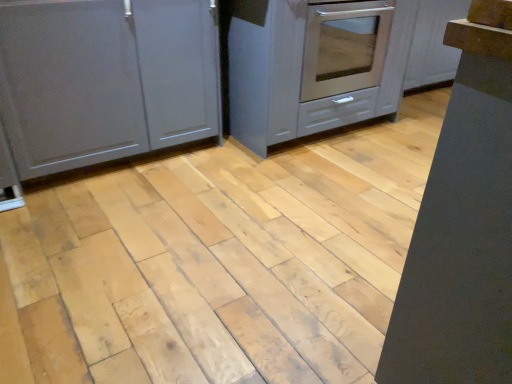
Describe the element at coordinates (314, 65) in the screenshot. This screenshot has height=384, width=512. I see `satin gray cabinet at center, which is the 2th cabinetry from left to right` at that location.

Find the location of a particular element. This screenshot has width=512, height=384. satin gray cabinet at center, the 1th cabinetry in the right-to-left sequence is located at coordinates (314, 65).

In order to face matte gray cabinet at left, which ranks as the 2th cabinetry in right-to-left order, should I rotate leftwards or rightwards?

Rotate your view left by about 19.146°.

The width and height of the screenshot is (512, 384). Describe the element at coordinates (105, 79) in the screenshot. I see `matte gray cabinet at left, which ranks as the 2th cabinetry in right-to-left order` at that location.

Locate an element on the screen. This screenshot has height=384, width=512. matte gray cabinet at left, which ranks as the 2th cabinetry in right-to-left order is located at coordinates (105, 79).

At what (x,y) coordinates should I click in order to perform the action: click on satin gray cabinet at center, the 1th cabinetry in the right-to-left sequence. Please return your answer as a coordinate pair (x, y). The image size is (512, 384). Looking at the image, I should click on (314, 65).

Can you confirm if matte gray cabinet at left, which ranks as the 2th cabinetry in right-to-left order, is positioned to the right of satin gray cabinet at center, which is the 2th cabinetry from left to right?

In fact, matte gray cabinet at left, which ranks as the 2th cabinetry in right-to-left order, is to the left of satin gray cabinet at center, which is the 2th cabinetry from left to right.

Relative to satin gray cabinet at center, which is the 2th cabinetry from left to right, is matte gray cabinet at left, which ranks as the 2th cabinetry in right-to-left order, in front or behind?

Clearly, matte gray cabinet at left, which ranks as the 2th cabinetry in right-to-left order, is in front of satin gray cabinet at center, which is the 2th cabinetry from left to right.

Which is less distant, [41,60] or [265,132]?

Point [41,60].

From the image's perspective, which one is positioned higher, matte gray cabinet at left, which ranks as the 2th cabinetry in right-to-left order, or satin gray cabinet at center, which is the 2th cabinetry from left to right?

satin gray cabinet at center, which is the 2th cabinetry from left to right, is shown above in the image.

From a real-world perspective, does matte gray cabinet at left, the 1th cabinetry in the left-to-right sequence, sit lower than satin gray cabinet at center, the 1th cabinetry in the right-to-left sequence?

Yes, from a real-world perspective, matte gray cabinet at left, the 1th cabinetry in the left-to-right sequence, is under satin gray cabinet at center, the 1th cabinetry in the right-to-left sequence.

Is matte gray cabinet at left, which ranks as the 2th cabinetry in right-to-left order, wider than satin gray cabinet at center, the 1th cabinetry in the right-to-left sequence?

In fact, matte gray cabinet at left, which ranks as the 2th cabinetry in right-to-left order, might be narrower than satin gray cabinet at center, the 1th cabinetry in the right-to-left sequence.

Considering the relative sizes of matte gray cabinet at left, which ranks as the 2th cabinetry in right-to-left order, and satin gray cabinet at center, the 1th cabinetry in the right-to-left sequence, in the image provided, is matte gray cabinet at left, which ranks as the 2th cabinetry in right-to-left order, taller than satin gray cabinet at center, the 1th cabinetry in the right-to-left sequence,?

Indeed, matte gray cabinet at left, which ranks as the 2th cabinetry in right-to-left order, has a greater height compared to satin gray cabinet at center, the 1th cabinetry in the right-to-left sequence.

Is matte gray cabinet at left, the 1th cabinetry in the left-to-right sequence, smaller than satin gray cabinet at center, which is the 2th cabinetry from left to right?

Yes, matte gray cabinet at left, the 1th cabinetry in the left-to-right sequence, is smaller than satin gray cabinet at center, which is the 2th cabinetry from left to right.

Is matte gray cabinet at left, the 1th cabinetry in the left-to-right sequence, completely or partially outside of satin gray cabinet at center, the 1th cabinetry in the right-to-left sequence?

Indeed, matte gray cabinet at left, the 1th cabinetry in the left-to-right sequence, is completely outside satin gray cabinet at center, the 1th cabinetry in the right-to-left sequence.

Could you tell me if matte gray cabinet at left, which ranks as the 2th cabinetry in right-to-left order, is facing satin gray cabinet at center, which is the 2th cabinetry from left to right?

No, matte gray cabinet at left, which ranks as the 2th cabinetry in right-to-left order, is not aimed at satin gray cabinet at center, which is the 2th cabinetry from left to right.

Based on the photo, how many degrees apart are the facing directions of matte gray cabinet at left, the 1th cabinetry in the left-to-right sequence, and satin gray cabinet at center, which is the 2th cabinetry from left to right?

The facing directions of matte gray cabinet at left, the 1th cabinetry in the left-to-right sequence, and satin gray cabinet at center, which is the 2th cabinetry from left to right, are 0.999 degrees apart.

How far apart are matte gray cabinet at left, which ranks as the 2th cabinetry in right-to-left order, and satin gray cabinet at center, which is the 2th cabinetry from left to right?

24.55 inches.

I want to click on cabinetry below the satin gray cabinet at center, which is the 2th cabinetry from left to right (from the image's perspective), so click(105, 79).

Does satin gray cabinet at center, which is the 2th cabinetry from left to right, appear on the right side of matte gray cabinet at left, which ranks as the 2th cabinetry in right-to-left order?

Yes, satin gray cabinet at center, which is the 2th cabinetry from left to right, is to the right of matte gray cabinet at left, which ranks as the 2th cabinetry in right-to-left order.

Looking at this image, between satin gray cabinet at center, which is the 2th cabinetry from left to right, and matte gray cabinet at left, the 1th cabinetry in the left-to-right sequence, which one is positioned in front?

matte gray cabinet at left, the 1th cabinetry in the left-to-right sequence.

Is point (276, 62) closer to camera compared to point (144, 34)?

No, it is not.

From the image's perspective, who appears lower, satin gray cabinet at center, the 1th cabinetry in the right-to-left sequence, or matte gray cabinet at left, which ranks as the 2th cabinetry in right-to-left order?

matte gray cabinet at left, which ranks as the 2th cabinetry in right-to-left order, from the image's perspective.

From a real-world perspective, between satin gray cabinet at center, which is the 2th cabinetry from left to right, and matte gray cabinet at left, which ranks as the 2th cabinetry in right-to-left order, who is vertically lower?

In real-world perspective, matte gray cabinet at left, which ranks as the 2th cabinetry in right-to-left order, is lower.

Which object is thinner, satin gray cabinet at center, which is the 2th cabinetry from left to right, or matte gray cabinet at left, which ranks as the 2th cabinetry in right-to-left order?

With smaller width is matte gray cabinet at left, which ranks as the 2th cabinetry in right-to-left order.

Is satin gray cabinet at center, which is the 2th cabinetry from left to right, taller than matte gray cabinet at left, which ranks as the 2th cabinetry in right-to-left order?

Incorrect, the height of satin gray cabinet at center, which is the 2th cabinetry from left to right, is not larger of that of matte gray cabinet at left, which ranks as the 2th cabinetry in right-to-left order.

Looking at this image, between satin gray cabinet at center, which is the 2th cabinetry from left to right, and matte gray cabinet at left, which ranks as the 2th cabinetry in right-to-left order, which one has larger size?

Bigger between the two is satin gray cabinet at center, which is the 2th cabinetry from left to right.

Is satin gray cabinet at center, the 1th cabinetry in the right-to-left sequence, positioned beyond the bounds of matte gray cabinet at left, the 1th cabinetry in the left-to-right sequence?

satin gray cabinet at center, the 1th cabinetry in the right-to-left sequence, lies outside matte gray cabinet at left, the 1th cabinetry in the left-to-right sequence,'s area.

Can you see satin gray cabinet at center, which is the 2th cabinetry from left to right, touching matte gray cabinet at left, the 1th cabinetry in the left-to-right sequence?

No, satin gray cabinet at center, which is the 2th cabinetry from left to right, is not in contact with matte gray cabinet at left, the 1th cabinetry in the left-to-right sequence.

From the picture: Does satin gray cabinet at center, which is the 2th cabinetry from left to right, turn towards matte gray cabinet at left, the 1th cabinetry in the left-to-right sequence?

No, satin gray cabinet at center, which is the 2th cabinetry from left to right, is not turned towards matte gray cabinet at left, the 1th cabinetry in the left-to-right sequence.

What's the angular difference between satin gray cabinet at center, the 1th cabinetry in the right-to-left sequence, and matte gray cabinet at left, the 1th cabinetry in the left-to-right sequence,'s facing directions?

The facing directions of satin gray cabinet at center, the 1th cabinetry in the right-to-left sequence, and matte gray cabinet at left, the 1th cabinetry in the left-to-right sequence, are 0.999 degrees apart.

Identify the location of cabinetry above the matte gray cabinet at left, which ranks as the 2th cabinetry in right-to-left order (from a real-world perspective). (314, 65).

Where is `cabinetry lying on the right of matte gray cabinet at left, the 1th cabinetry in the left-to-right sequence`? The height and width of the screenshot is (384, 512). cabinetry lying on the right of matte gray cabinet at left, the 1th cabinetry in the left-to-right sequence is located at coordinates (314, 65).

Image resolution: width=512 pixels, height=384 pixels. Find the location of `cabinetry above the matte gray cabinet at left, the 1th cabinetry in the left-to-right sequence (from the image's perspective)`. cabinetry above the matte gray cabinet at left, the 1th cabinetry in the left-to-right sequence (from the image's perspective) is located at coordinates (314, 65).